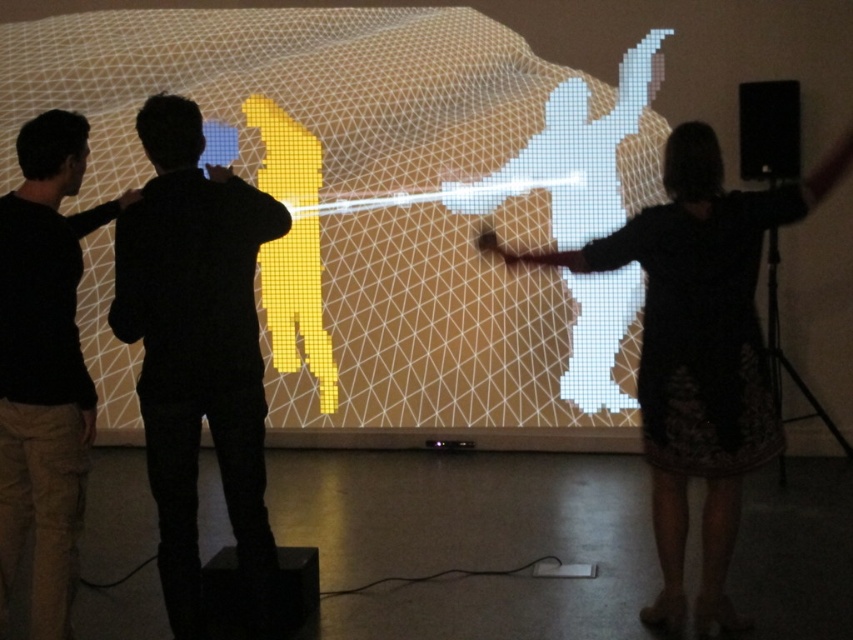
Can you confirm if yellow pixelated figure at center is thinner than black matte shirt at left?

Incorrect, yellow pixelated figure at center's width is not less than black matte shirt at left's.

How distant is yellow pixelated figure at center from black matte shirt at left?

yellow pixelated figure at center is 8.58 feet away from black matte shirt at left.

Describe the element at coordinates (387, 198) in the screenshot. I see `yellow pixelated figure at center` at that location.

Find the location of a particular element. yellow pixelated figure at center is located at coordinates (387, 198).

Is point (769, 420) positioned behind point (28, 356)?

Yes, it is.

Is black lace dress at center further to camera compared to black matte shirt at left?

Yes, it is.

The image size is (853, 640). Find the location of `black lace dress at center`. black lace dress at center is located at coordinates (699, 352).

Looking at this image, is silhouette man at center to the right of black lace dress at center from the viewer's perspective?

Incorrect, silhouette man at center is not on the right side of black lace dress at center.

Which is more to the left, silhouette man at center or black lace dress at center?

From the viewer's perspective, silhouette man at center appears more on the left side.

Which is in front, point (190, 337) or point (648, 605)?

Point (190, 337) is more forward.

At what (x,y) coordinates should I click in order to perform the action: click on silhouette man at center. Please return your answer as a coordinate pair (x, y). The height and width of the screenshot is (640, 853). Looking at the image, I should click on (198, 353).